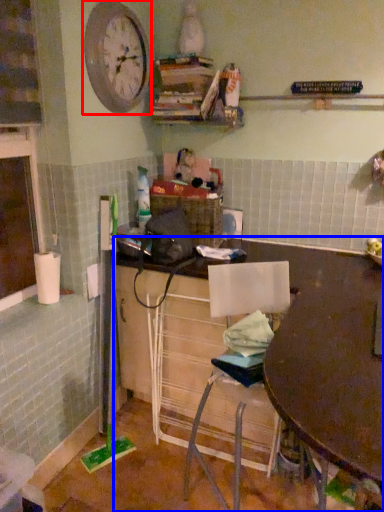
Question: Which object appears farthest to the camera in this image, clock (highlighted by a red box) or desk (highlighted by a blue box)?

Choices:
 (A) clock
 (B) desk

Answer: (A)